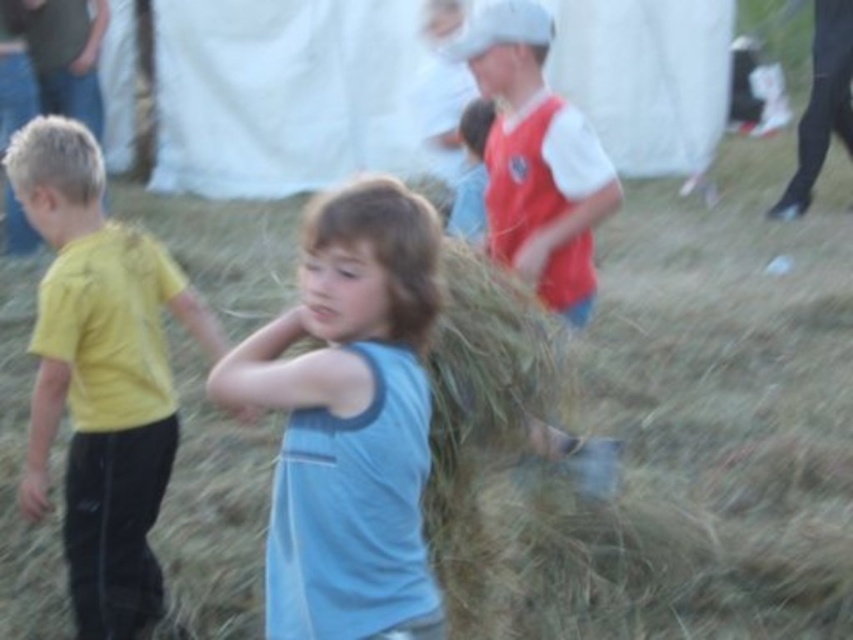
Question: Which of the following is the farthest from the observer?

Choices:
 (A) (41, 317)
 (B) (552, 148)
 (C) (369, 305)

Answer: (B)

Question: Which object is farther from the camera taking this photo?

Choices:
 (A) red jersey at center
 (B) yellow matte shirt at left

Answer: (A)

Question: Does yellow matte shirt at left have a greater width compared to red jersey at center?

Choices:
 (A) no
 (B) yes

Answer: (B)

Question: Does light blue cotton shirt at center have a greater width compared to yellow matte shirt at left?

Choices:
 (A) no
 (B) yes

Answer: (A)

Question: Based on their relative distances, which object is farther from the light blue cotton shirt at center?

Choices:
 (A) red jersey at center
 (B) yellow matte shirt at left

Answer: (A)

Question: From the image, what is the correct spatial relationship of light blue cotton shirt at center in relation to yellow matte shirt at left?

Choices:
 (A) below
 (B) above

Answer: (B)